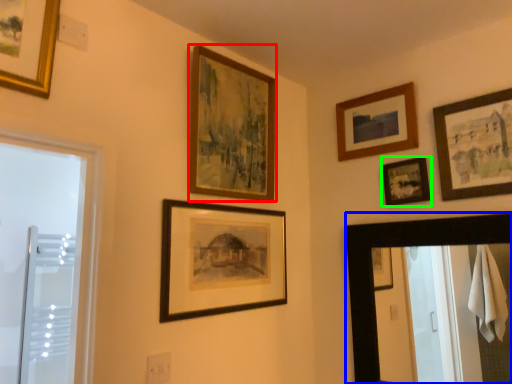
Question: Which object is positioned farthest from picture frame (highlighted by a red box)? Select from mirror (highlighted by a blue box) and picture frame (highlighted by a green box).

Choices:
 (A) mirror
 (B) picture frame

Answer: (A)